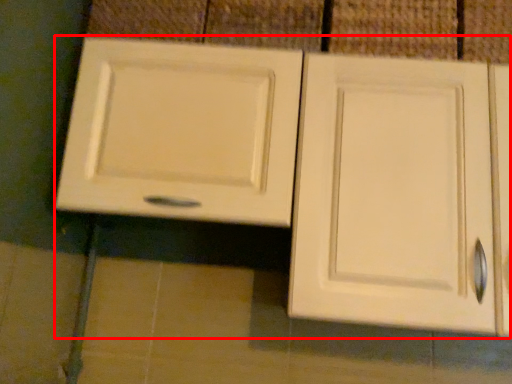
Question: From the image's perspective, where is cabinetry (annotated by the red box) located in relation to tile in the image?

Choices:
 (A) above
 (B) below

Answer: (B)